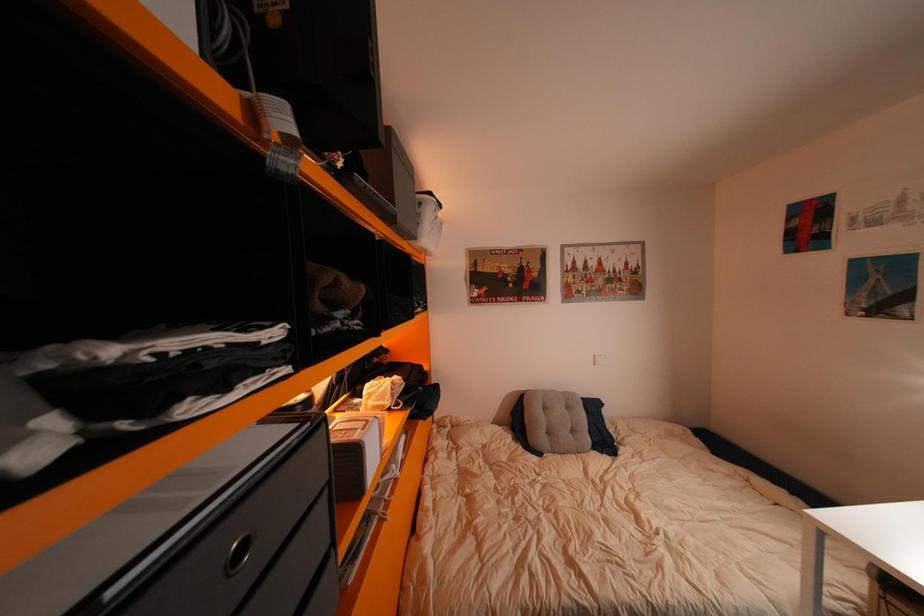
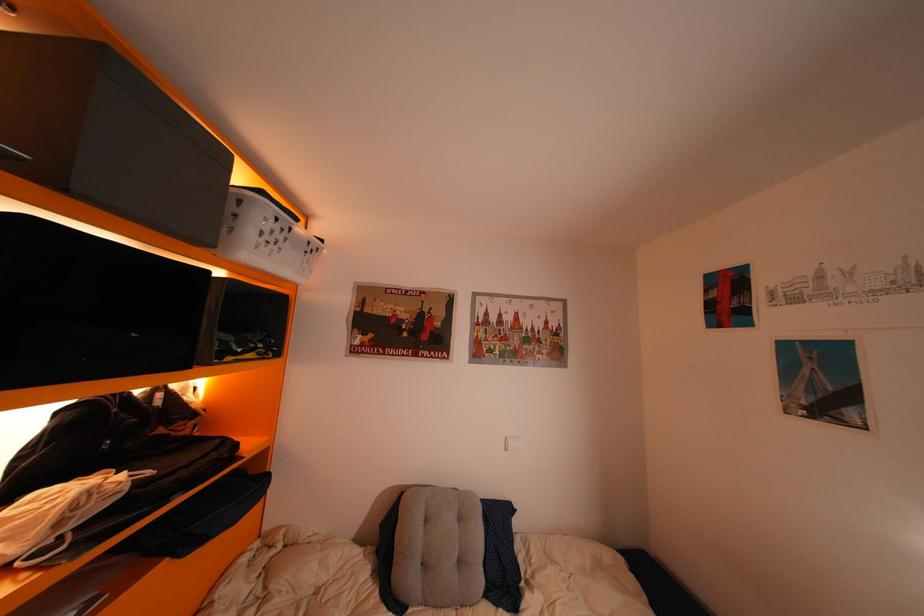
Question: Based on the continuous images, in which direction is the camera rotating? Reply with the corresponding letter.

Choices:
 (A) Left
 (B) Right
 (C) Up
 (D) Down

Answer: (C)